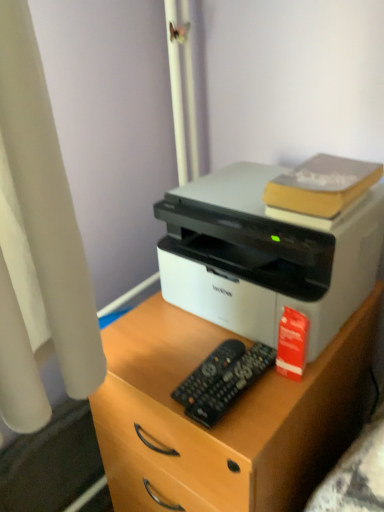
At what (x,y) coordinates should I click in order to perform the action: click on vacant space behind black plastic remote at center, which is the second control from front to back. Please return your answer as a coordinate pair (x, y). The width and height of the screenshot is (384, 512). Looking at the image, I should click on (183, 332).